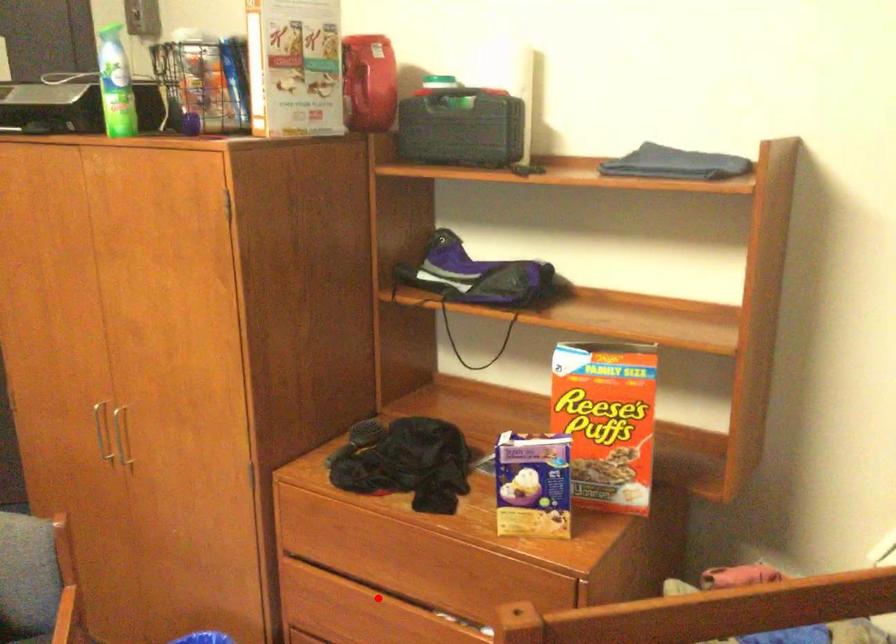
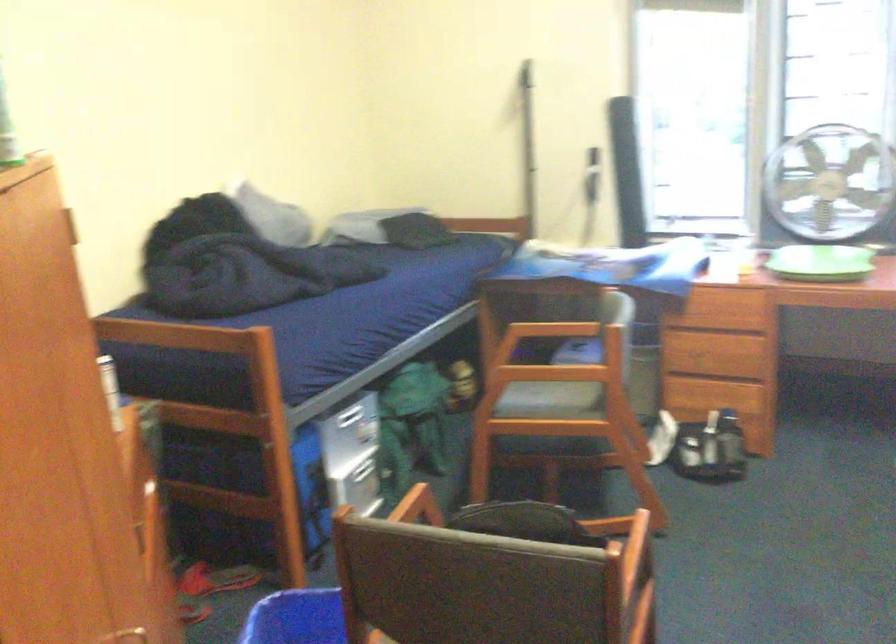
Question: I am providing you with two images of the same scene from different viewpoints. A red point is marked on the first image. Is the red point's position out of view in image 2?

Choices:
 (A) Yes
 (B) No

Answer: (A)